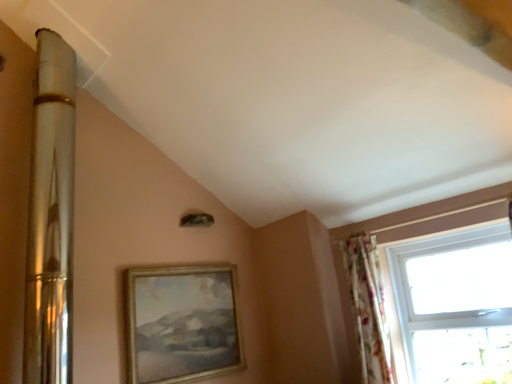
What do you see at coordinates (413, 236) in the screenshot?
I see `transparent glass window at right` at bounding box center [413, 236].

Where is `transparent glass window at right`? transparent glass window at right is located at coordinates (413, 236).

Is transparent glass window at right to the left or to the right of gold/golden wood picture frame at center in the image?

transparent glass window at right is positioned on gold/golden wood picture frame at center's right side.

Is transparent glass window at right next to gold/golden wood picture frame at center and touching it?

No, transparent glass window at right is not touching gold/golden wood picture frame at center.

Which is behind, point (393, 240) or point (179, 360)?

The point (393, 240) is more distant.

From a real-world perspective, which is physically above, transparent glass window at right or gold/golden wood picture frame at center?

gold/golden wood picture frame at center, from a real-world perspective.

Choose the correct answer: Is gold/golden wood picture frame at center inside floral fabric curtain at right or outside it?

gold/golden wood picture frame at center is not inside floral fabric curtain at right, it's outside.

Identify the location of picture frame below the floral fabric curtain at right (from the image's perspective). The image size is (512, 384). (181, 323).

Considering the positions of objects gold/golden wood picture frame at center and floral fabric curtain at right in the image provided, who is more to the left, gold/golden wood picture frame at center or floral fabric curtain at right?

From the viewer's perspective, gold/golden wood picture frame at center appears more on the left side.

Which object is closer to the camera, gold/golden wood picture frame at center or floral fabric curtain at right?

gold/golden wood picture frame at center is in front.

Considering the relative sizes of gold/golden wood picture frame at center and transparent glass window at right in the image provided, is gold/golden wood picture frame at center thinner than transparent glass window at right?

In fact, gold/golden wood picture frame at center might be wider than transparent glass window at right.

Is point (202, 320) positioned before point (342, 301)?

Yes, it is in front of point (342, 301).

Can you confirm if gold/golden wood picture frame at center is taller than transparent glass window at right?

Incorrect, the height of gold/golden wood picture frame at center is not larger of that of transparent glass window at right.

How different are the orientations of gold/golden wood picture frame at center and transparent glass window at right in degrees?

The facing directions of gold/golden wood picture frame at center and transparent glass window at right are 90.5 degrees apart.

How far apart are floral fabric curtain at right and gold/golden wood picture frame at center?

The distance of floral fabric curtain at right from gold/golden wood picture frame at center is 1.08 meters.

From the image's perspective, who appears lower, floral fabric curtain at right or gold/golden wood picture frame at center?

gold/golden wood picture frame at center is shown below in the image.

Which point is more distant from viewer, (379, 307) or (190, 285)?

The point (190, 285) is farther.

From a real-world perspective, which is physically below, floral fabric curtain at right or gold/golden wood picture frame at center?

floral fabric curtain at right, from a real-world perspective.

Based on the photo, is floral fabric curtain at right beside transparent glass window at right?

No, floral fabric curtain at right is not next to transparent glass window at right.

Is point (376, 301) closer to viewer compared to point (457, 203)?

That is False.

From the image's perspective, is floral fabric curtain at right under transparent glass window at right?

Yes.

Considering the relative sizes of floral fabric curtain at right and transparent glass window at right in the image provided, is floral fabric curtain at right wider than transparent glass window at right?

Yes.

Looking at this image, who is bigger, transparent glass window at right or floral fabric curtain at right?

transparent glass window at right is bigger.

Between transparent glass window at right and floral fabric curtain at right, which one has smaller width?

transparent glass window at right is thinner.

From a real-world perspective, who is located lower, transparent glass window at right or floral fabric curtain at right?

transparent glass window at right.

Considering the relative positions of transparent glass window at right and floral fabric curtain at right in the image provided, is transparent glass window at right in front of floral fabric curtain at right?

Yes, the depth of transparent glass window at right is less than that of floral fabric curtain at right.

Locate an element on the screen. This screenshot has height=384, width=512. picture frame that appears below the transparent glass window at right (from the image's perspective) is located at coordinates (181, 323).

This screenshot has height=384, width=512. I want to click on curtain that is behind the gold/golden wood picture frame at center, so click(x=368, y=308).

Looking at the image, which one is located closer to transparent glass window at right, gold/golden wood picture frame at center or floral fabric curtain at right?

Among the two, floral fabric curtain at right is located nearer to transparent glass window at right.

From the image, which object appears to be nearer to gold/golden wood picture frame at center, floral fabric curtain at right or transparent glass window at right?

Based on the image, floral fabric curtain at right appears to be nearer to gold/golden wood picture frame at center.

Which object lies further to the anchor point floral fabric curtain at right, gold/golden wood picture frame at center or transparent glass window at right?

Among the two, gold/golden wood picture frame at center is located further to floral fabric curtain at right.

Which object lies further to the anchor point gold/golden wood picture frame at center, transparent glass window at right or floral fabric curtain at right?

Based on the image, transparent glass window at right appears to be further to gold/golden wood picture frame at center.

Estimate the real-world distances between objects in this image. Which object is further from floral fabric curtain at right, transparent glass window at right or gold/golden wood picture frame at center?

gold/golden wood picture frame at center lies further to floral fabric curtain at right than the other object.

Based on their spatial positions, is floral fabric curtain at right or gold/golden wood picture frame at center further from transparent glass window at right?

Based on the image, gold/golden wood picture frame at center appears to be further to transparent glass window at right.

I want to click on curtain located between gold/golden wood picture frame at center and transparent glass window at right in the left-right direction, so click(x=368, y=308).